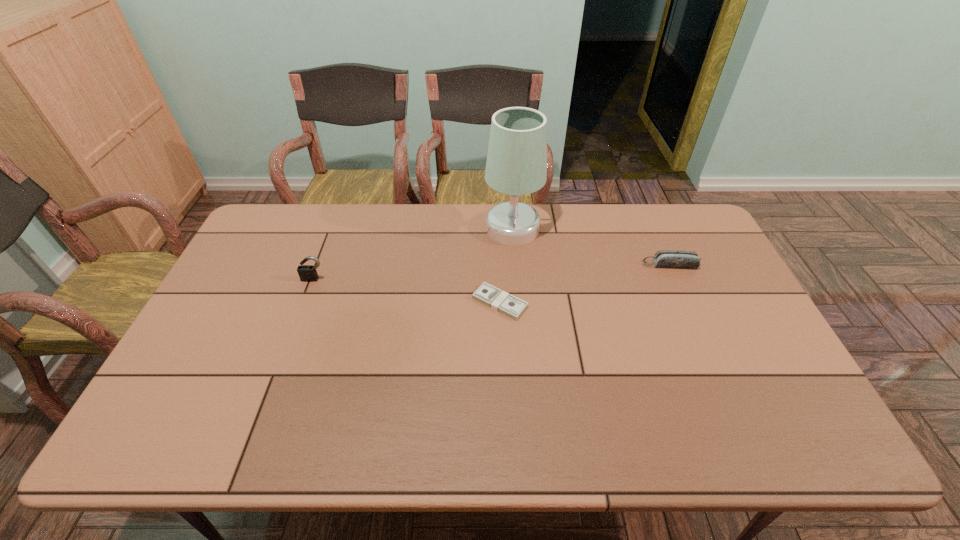
This screenshot has height=540, width=960. In order to click on free location at the far left corner in this screenshot , I will do `click(245, 245)`.

The width and height of the screenshot is (960, 540). I want to click on free space at the far right corner of the desktop, so click(x=669, y=206).

In order to click on vacant space that's between the pencil box and the shortest object in this screenshot , I will do `click(585, 284)`.

At what (x,y) coordinates should I click in order to perform the action: click on free spot between the shortest object and the pencil box. Please return your answer as a coordinate pair (x, y). Looking at the image, I should click on (585, 284).

Find the location of a particular element. blank region between the dollar and the tallest object is located at coordinates (506, 266).

I want to click on vacant point located between the leftmost object and the pencil box, so click(x=492, y=272).

This screenshot has height=540, width=960. I want to click on free space that is in between the second nearest object and the tallest object, so click(x=413, y=254).

At what (x,y) coordinates should I click in order to perform the action: click on unoccupied position between the lampshade and the nearest object. Please return your answer as a coordinate pair (x, y). The height and width of the screenshot is (540, 960). Looking at the image, I should click on (506, 266).

The image size is (960, 540). What are the coordinates of `vacant area that lies between the third nearest object and the lampshade` in the screenshot? It's located at (591, 247).

Image resolution: width=960 pixels, height=540 pixels. Identify the location of vacant space in between the rightmost object and the padlock. (492, 272).